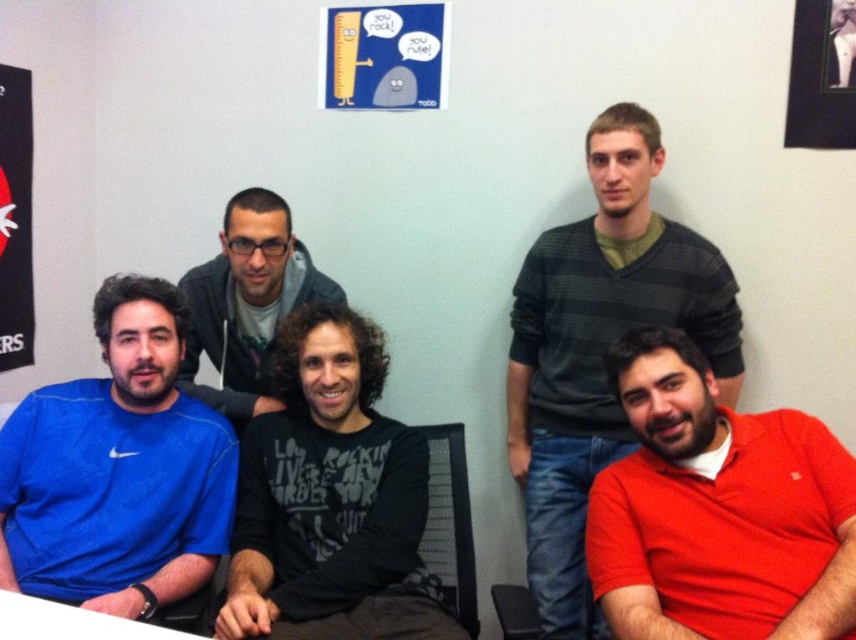
You are standing in the office and want to hand a document to the person wearing the red matte shirt at lower right. If you are currently 6 feet away from them, can you reach them without moving closer?

The red matte shirt at lower right is 4.30 feet away from the viewer, so you are already closer than 6 feet. You can reach them without moving closer.

You are standing in the office and need to find the red matte shirt at lower right. According to the coordinates provided, where exactly is it positioned?

The red matte shirt at lower right is located at point 0.800 on the x axis and 0.840 on the y axis.